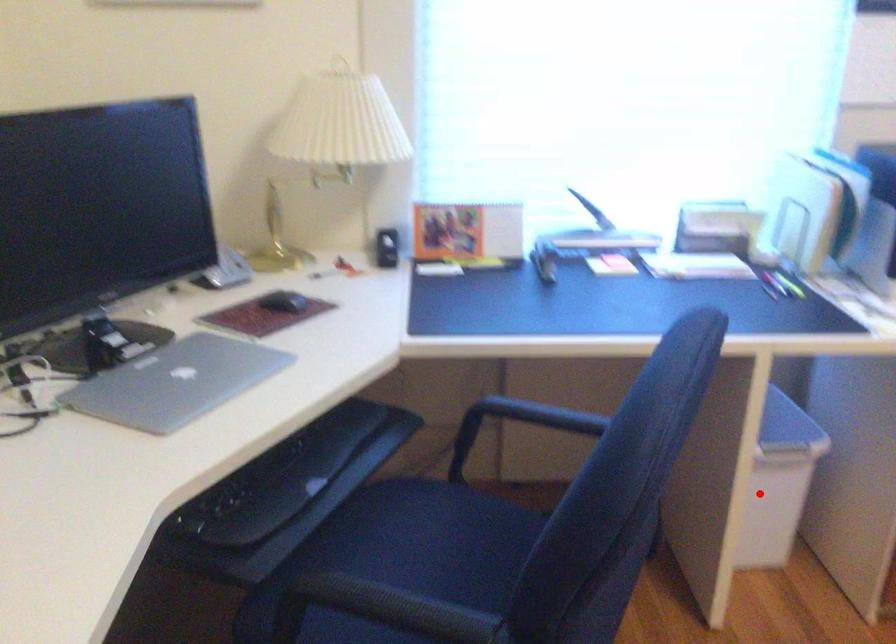
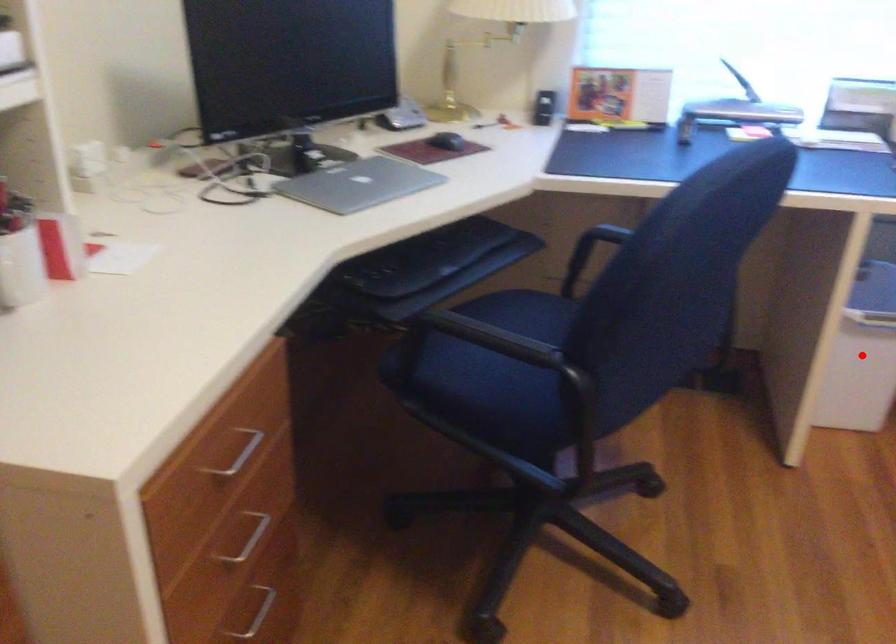
I am providing you with two images of the same scene from different viewpoints. A red point is marked on the first image and another point is marked on the second image. Is the marked point in image1 the same physical position as the marked point in image2?

Yes